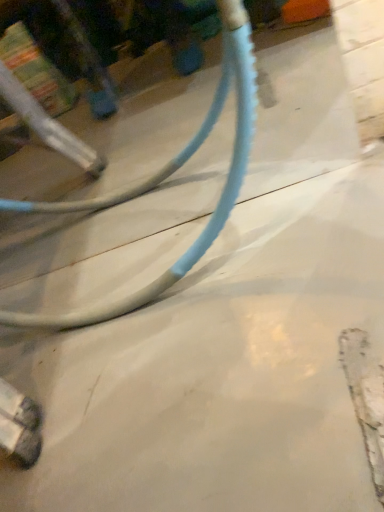
Question: From a real-world perspective, relative to smooth concrete at center, is blue rubber hose at center vertically above or below?

Choices:
 (A) below
 (B) above

Answer: (B)

Question: Considering their positions, is blue rubber hose at center located in front of or behind smooth concrete at center?

Choices:
 (A) front
 (B) behind

Answer: (A)

Question: Is blue rubber hose at center spatially inside smooth concrete at center, or outside of it?

Choices:
 (A) inside
 (B) outside

Answer: (B)

Question: Is smooth concrete at center in front of or behind blue rubber hose at center in the image?

Choices:
 (A) front
 (B) behind

Answer: (B)

Question: Is smooth concrete at center spatially inside blue rubber hose at center, or outside of it?

Choices:
 (A) inside
 (B) outside

Answer: (B)

Question: Considering the positions of point (329, 294) and point (249, 80), is point (329, 294) closer or farther from the camera than point (249, 80)?

Choices:
 (A) closer
 (B) farther

Answer: (B)

Question: From a real-world perspective, is smooth concrete at center physically located above or below blue rubber hose at center?

Choices:
 (A) below
 (B) above

Answer: (A)